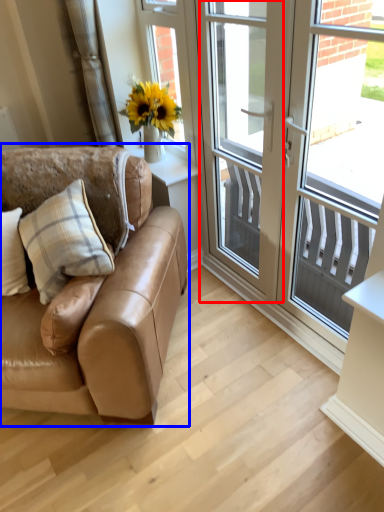
Question: Among these objects, which one is farthest to the camera, screen door (highlighted by a red box) or studio couch (highlighted by a blue box)?

Choices:
 (A) screen door
 (B) studio couch

Answer: (A)